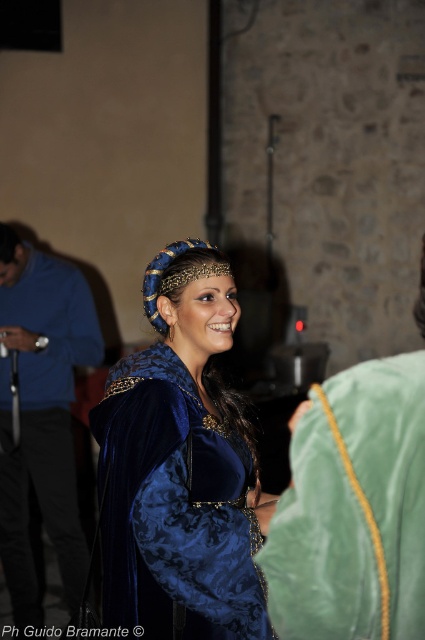
Question: Does velvet blue dress at center have a larger size compared to green velvet robe at center?

Choices:
 (A) yes
 (B) no

Answer: (A)

Question: Among these objects, which one is nearest to the camera?

Choices:
 (A) velvet blue robe at center
 (B) velvet blue dress at center
 (C) green velvet robe at center

Answer: (C)

Question: Is green velvet robe at center closer to camera compared to velvet blue robe at center?

Choices:
 (A) yes
 (B) no

Answer: (A)

Question: Does green velvet robe at center appear over velvet blue robe at center?

Choices:
 (A) yes
 (B) no

Answer: (A)

Question: Which object is closer to the camera taking this photo?

Choices:
 (A) velvet blue dress at center
 (B) velvet blue robe at center

Answer: (A)

Question: Which point appears farthest from the camera in this image?

Choices:
 (A) (404, 362)
 (B) (59, 502)

Answer: (B)